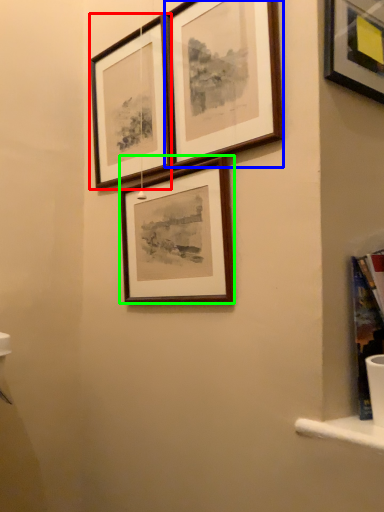
Question: Which is farther away from picture frame (highlighted by a red box)? picture frame (highlighted by a blue box) or picture frame (highlighted by a green box)?

Choices:
 (A) picture frame
 (B) picture frame

Answer: (B)